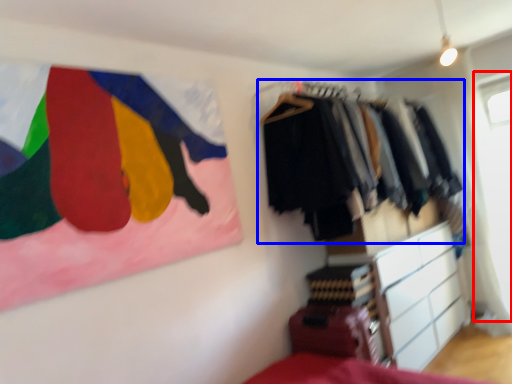
Question: Which object is closer to the camera taking this photo, window screen (highlighted by a red box) or closet (highlighted by a blue box)?

Choices:
 (A) window screen
 (B) closet

Answer: (B)